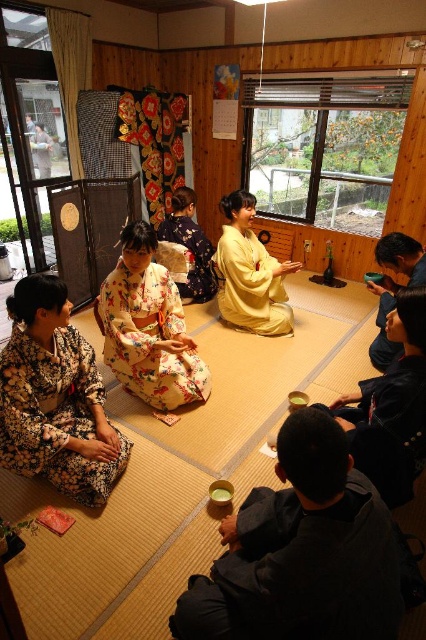
Question: Observing the image, what is the correct spatial positioning of floral silk kimono at center in reference to yellow silk kimono at center?

Choices:
 (A) above
 (B) below

Answer: (B)

Question: Can you confirm if yellow silk kimono at center is positioned above floral kimono at center?

Choices:
 (A) yes
 (B) no

Answer: (B)

Question: Which point is closer to the camera taking this photo?

Choices:
 (A) (377, 342)
 (B) (275, 618)
 (C) (118, 470)
 (D) (385, 420)

Answer: (B)

Question: Which point is closer to the camera?

Choices:
 (A) (385, 337)
 (B) (195, 248)
 (C) (311, 609)
 (D) (8, 387)

Answer: (C)

Question: Can you confirm if floral kimono at lower left is wider than yellow silk kimono at center?

Choices:
 (A) no
 (B) yes

Answer: (A)

Question: Which point is closer to the camera taking this photo?

Choices:
 (A) (149, 294)
 (B) (198, 282)
 (C) (94, 413)

Answer: (C)